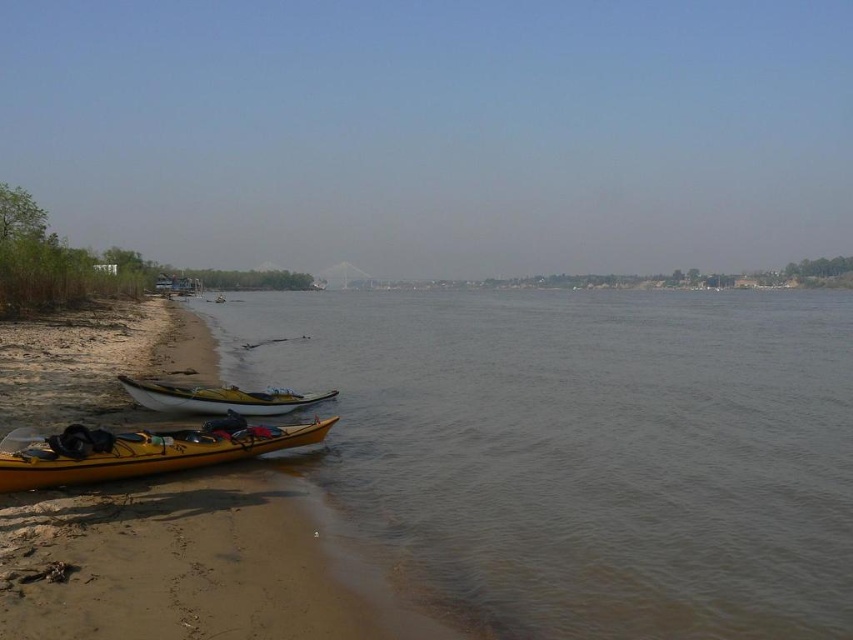
You are a hiker who just arrived at the riverside and see the yellow matte canoe at lower left and the white matte canoe at lower left. You need to paddle across the river to the opposite bank. If your backpack is 4 meters long, can you safely store it in the space between the two canoes without exceeding their separation distance?

The yellow matte canoe at lower left is 4.61 meters away from the white matte canoe at lower left. Since your backpack is 4 meters long, it will fit within the space between them without exceeding the separation distance.

Based on the photo, you are a kayaker planning to cross the river from the yellow matte canoe at lower left to the brown matte water at center. Given that your kayak can travel 1 meter per second, how many seconds will it take to reach the destination?

The distance between the yellow matte canoe at lower left and the brown matte water at center is 30.36 meters. At a speed of 1 meter per second, it would take 30.36 seconds to reach the destination.

You are planning to launch a small drone from the yellow matte canoe at lower left. Considering the brown matte water at center is above it, will the drone have enough vertical space to ascend safely without hitting the water?

The brown matte water at center is located above the yellow matte canoe at lower left, so the drone may not have enough vertical space to ascend safely as the water is positioned above the canoe.